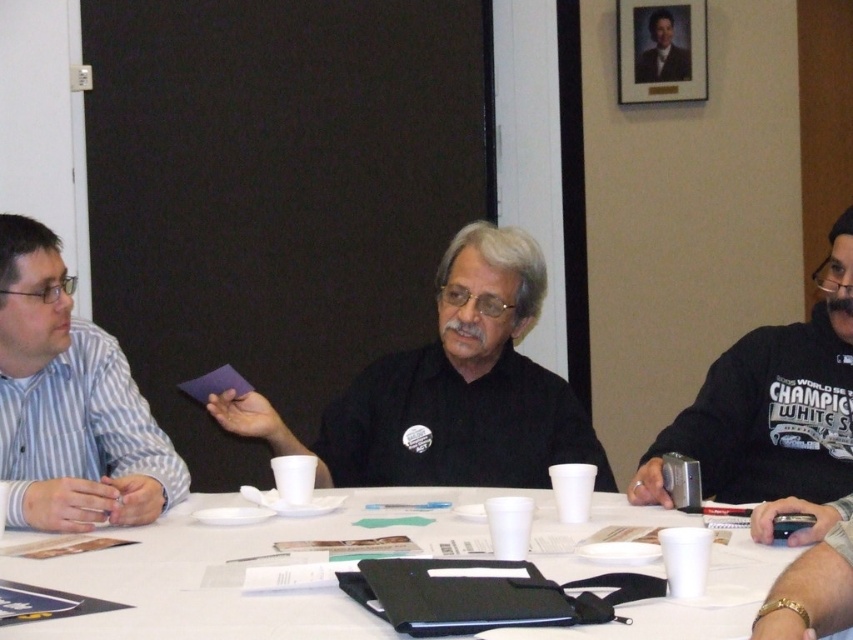
Question: Does striped cotton shirt at left appear on the right side of black jersey at right?

Choices:
 (A) no
 (B) yes

Answer: (A)

Question: Which point appears closest to the camera in this image?

Choices:
 (A) pos(123,577)
 (B) pos(357,413)

Answer: (A)

Question: Can you confirm if white paper table at center is positioned below striped cotton shirt at left?

Choices:
 (A) no
 (B) yes

Answer: (B)

Question: Which point appears closest to the camera in this image?

Choices:
 (A) (x=91, y=480)
 (B) (x=440, y=337)
 (C) (x=183, y=513)
 (D) (x=711, y=474)

Answer: (C)

Question: Which point is closer to the camera?

Choices:
 (A) (824, 499)
 (B) (57, 321)
 (C) (666, 616)
 (D) (376, 401)

Answer: (C)

Question: Does black matte shirt at center have a smaller size compared to black jersey at right?

Choices:
 (A) yes
 (B) no

Answer: (A)